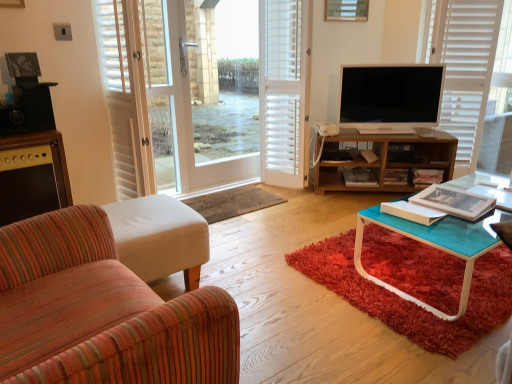
This screenshot has width=512, height=384. I want to click on free spot in front of rug at center, so click(250, 231).